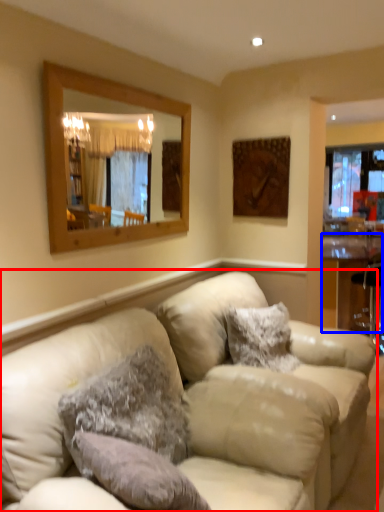
Question: Among these objects, which one is nearest to the camera, studio couch (highlighted by a red box) or table (highlighted by a blue box)?

Choices:
 (A) studio couch
 (B) table

Answer: (A)